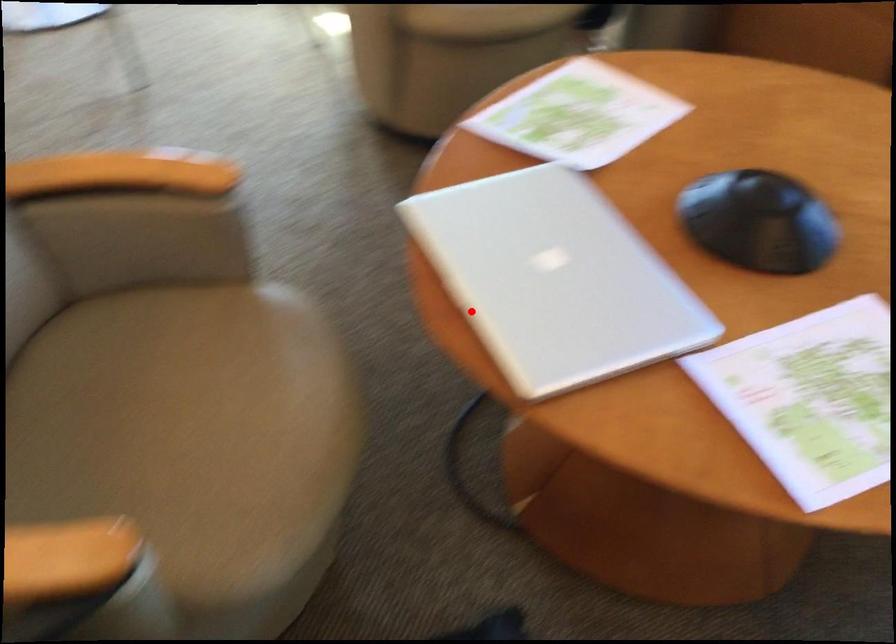
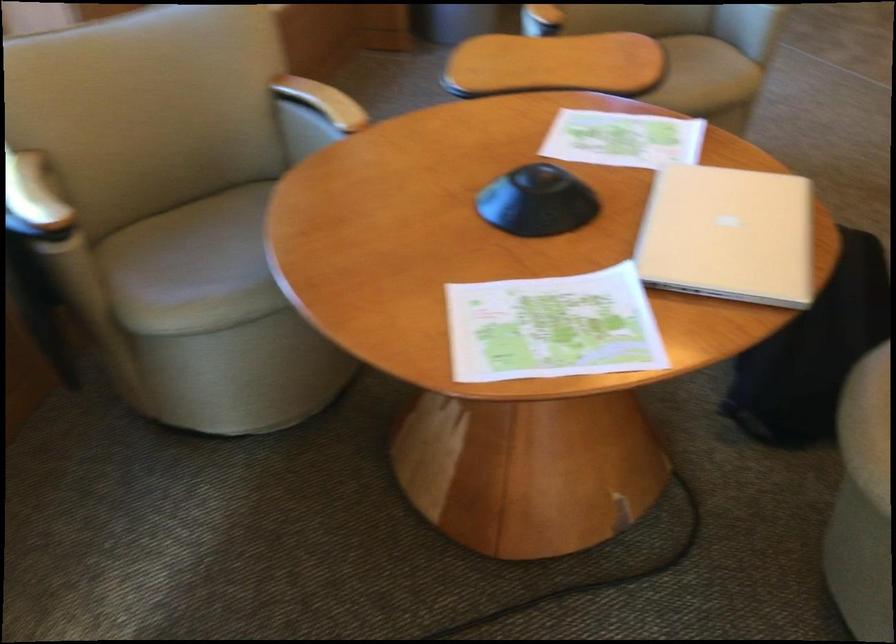
Question: I am providing you with two images of the same scene from different viewpoints. In image1, a red point is highlighted. Considering the same 3D point in image2, which of the following is correct?

Choices:
 (A) It is closer
 (B) It is farther

Answer: (B)